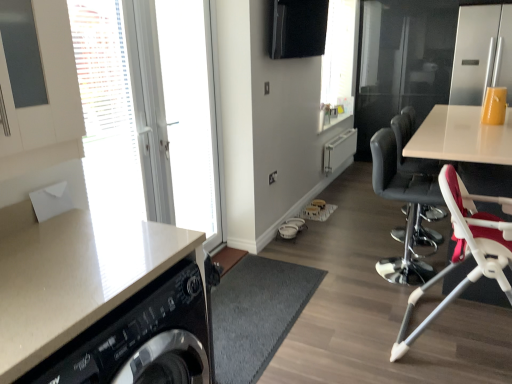
Locate an element on the screen. This screenshot has height=384, width=512. free point behind black leather bar stool at right is located at coordinates [x=381, y=214].